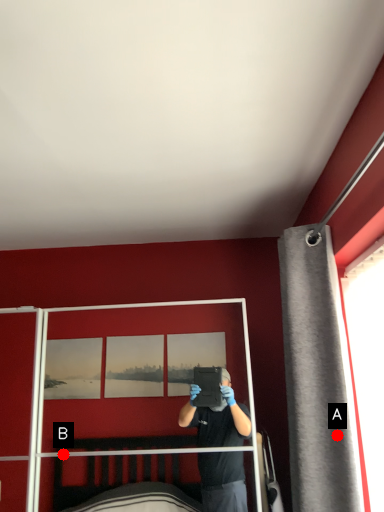
Question: Two points are circled on the image, labeled by A and B beside each circle. Which of the following is the closest to the observer?

Choices:
 (A) A is closer
 (B) B is closer

Answer: (A)